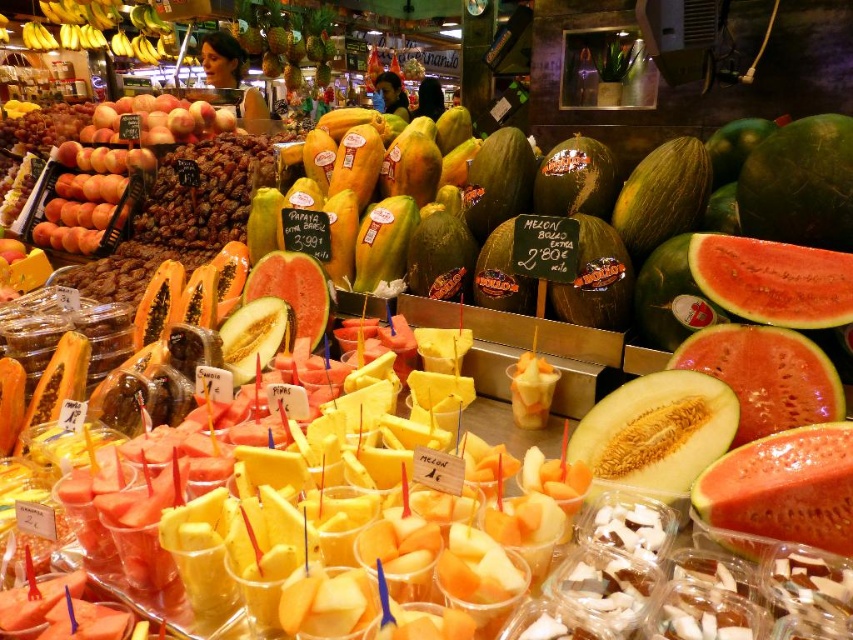
You are a customer at the fruit market and want to pick up both the matte orange peaches at center and the juicy red watermelon at center. Which fruit should you reach for first if you want to grab the one closer to you?

The matte orange peaches at center is closer to you than the juicy red watermelon at center, so you should reach for the matte orange peaches at center first.